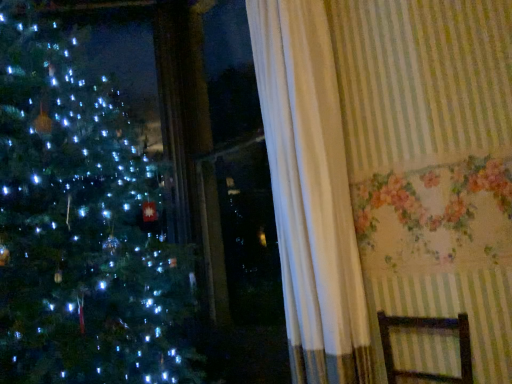
What do you see at coordinates (426, 328) in the screenshot?
I see `brown wooden armchair at lower right` at bounding box center [426, 328].

This screenshot has height=384, width=512. In order to click on brown wooden armchair at lower right in this screenshot , I will do `click(426, 328)`.

Identify the location of brown wooden armchair at lower right. (426, 328).